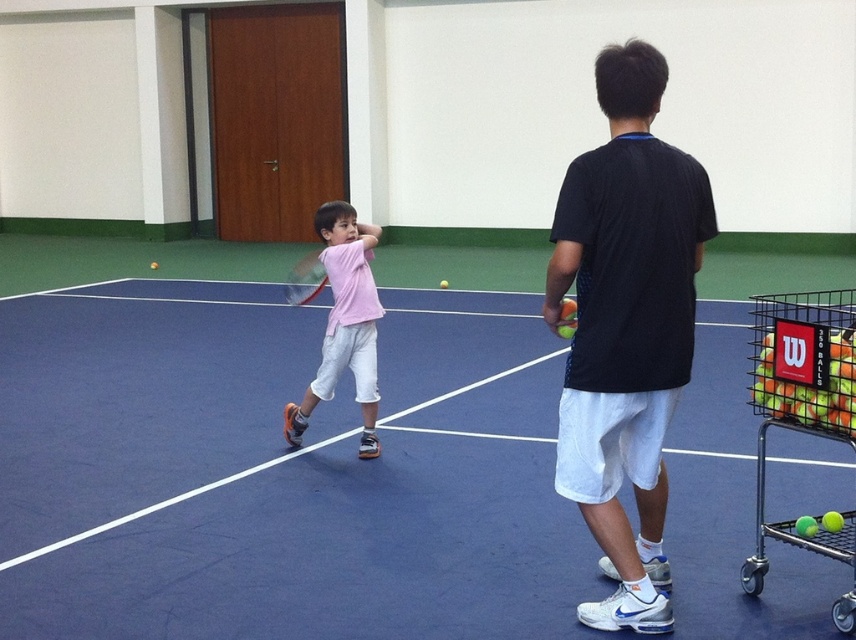
Question: Which of these objects is positioned farthest from the black fabric shirt at center?

Choices:
 (A) blue synthetic tennis court at center
 (B) green rubber tennis ball cart at right
 (C) pink matte shirt at center
 (D) yellow-green rubber tennis balls at lower right

Answer: (C)

Question: Is black fabric shirt at center to the left of pink matte shirt at center from the viewer's perspective?

Choices:
 (A) no
 (B) yes

Answer: (A)

Question: Which point is farther to the camera?

Choices:
 (A) pink matte shirt at center
 (B) yellow-green rubber tennis balls at lower right
 (C) green rubber tennis ball cart at right
 (D) black fabric shirt at center

Answer: (A)

Question: Can you confirm if blue synthetic tennis court at center is positioned above green rubber tennis ball cart at right?

Choices:
 (A) no
 (B) yes

Answer: (A)

Question: Which point is closer to the camera?

Choices:
 (A) green rubber tennis ball cart at right
 (B) yellow-green rubber tennis balls at lower right

Answer: (A)

Question: Does black fabric shirt at center have a smaller size compared to yellow-green rubber tennis balls at lower right?

Choices:
 (A) yes
 (B) no

Answer: (B)